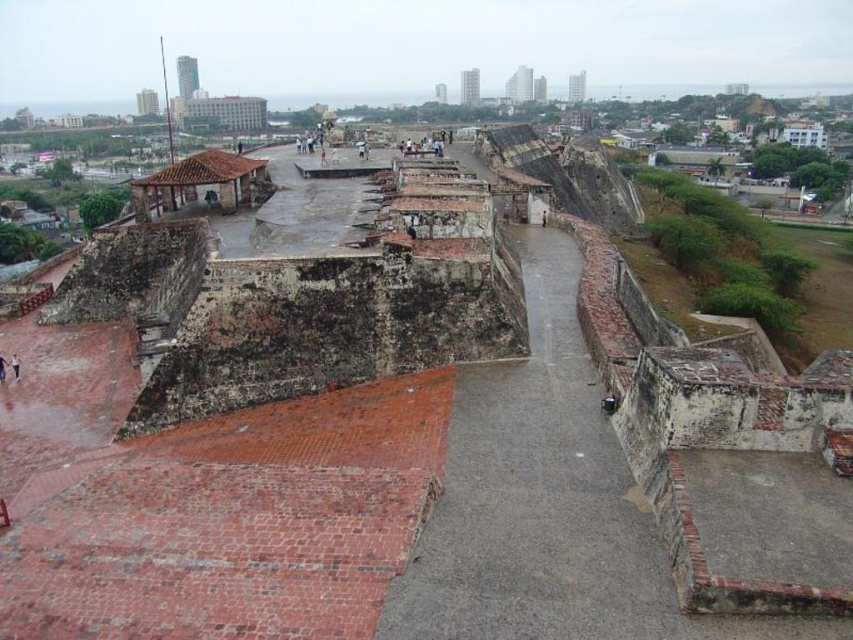
You are standing at the fortress walkway and want to reach the entrance of the fortress. You see two points marked on the path. Which point is closer to the entrance? The points are point [505,593] and point [3,369].

Point [505,593] is in front of point [3,369], so it is closer to the entrance.

You are standing on the walkway in the fortress and notice a brown leather shoe at lower left. If you want to reach it from your current position at point 0.5, what direction should you move in?

Since the brown leather shoe at lower left is located at point 0.019 on the y axis, which is lower than your current position at 0.5, you should move downward to reach it.